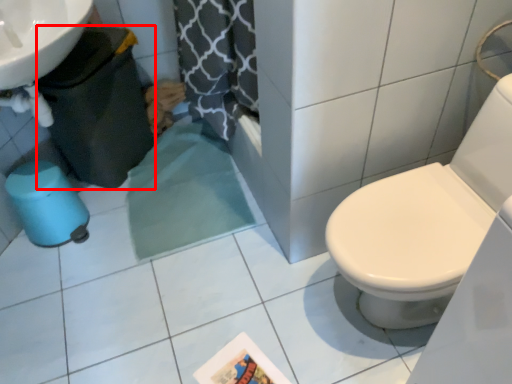
Question: From the image's perspective, where is potty (annotated by the red box) located relative to potty?

Choices:
 (A) above
 (B) below

Answer: (A)